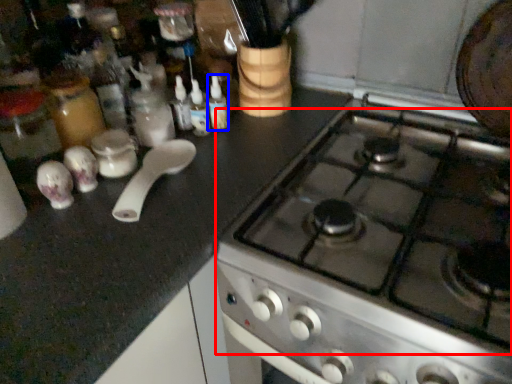
Question: Among these objects, which one is nearest to the camera, gas stove (highlighted by a red box) or bottle (highlighted by a blue box)?

Choices:
 (A) gas stove
 (B) bottle

Answer: (A)